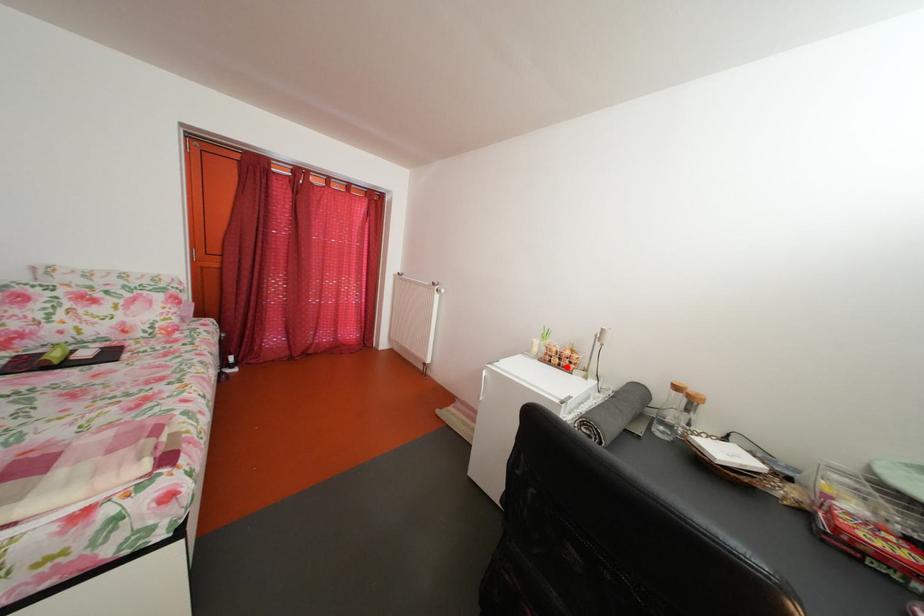
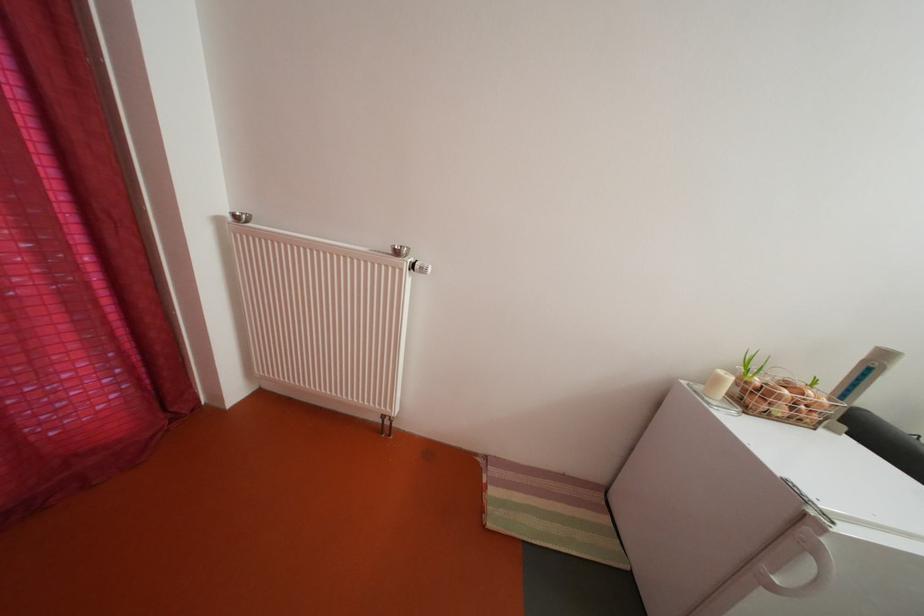
In the second image, find the point that corresponds to the highlighted location in the first image.

(792, 416)